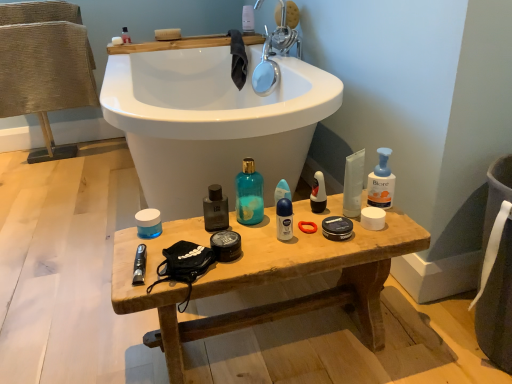
Identify the location of unoccupied space behind metallic black razor at lower left. (157, 235).